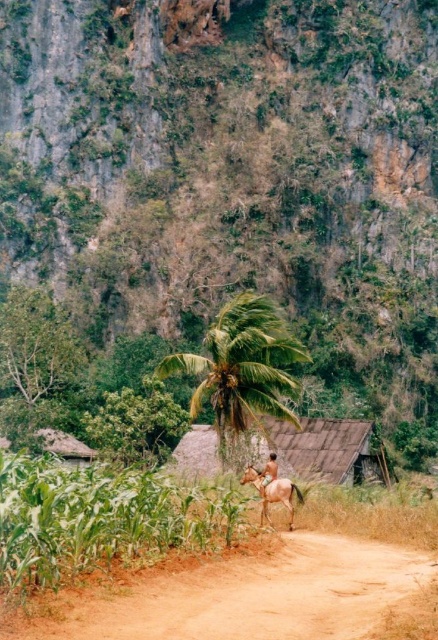
Question: Is green leafy palm tree at center to the right of brown glossy horse at center from the viewer's perspective?

Choices:
 (A) no
 (B) yes

Answer: (A)

Question: Which is farther from the brown leather horse at center?

Choices:
 (A) green leafy hillside at upper center
 (B) brown dirt track at lower center
 (C) green leafy palm tree at center

Answer: (A)

Question: Does green leafy palm tree at center have a smaller size compared to brown thatched hut at center?

Choices:
 (A) no
 (B) yes

Answer: (A)

Question: Which of the following is the closest to the observer?

Choices:
 (A) (268, 422)
 (B) (286, 506)
 (C) (317, 596)
 (D) (225, 442)

Answer: (C)

Question: Which object appears farthest from the camera in this image?

Choices:
 (A) green leafy palm tree at center
 (B) brown thatched hut at center
 (C) brown dirt track at lower center
 (D) green leafy hillside at upper center

Answer: (D)

Question: Is green leafy palm tree at center bigger than brown leather horse at center?

Choices:
 (A) no
 (B) yes

Answer: (B)